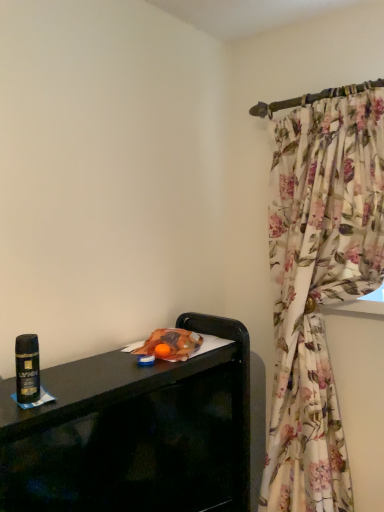
Find the location of a particular element. This screenshot has width=384, height=512. black glossy tv stand at lower left is located at coordinates (135, 433).

Image resolution: width=384 pixels, height=512 pixels. What do you see at coordinates (135, 433) in the screenshot?
I see `black glossy tv stand at lower left` at bounding box center [135, 433].

Image resolution: width=384 pixels, height=512 pixels. Identify the location of shiny black can at left. (27, 368).

The image size is (384, 512). Describe the element at coordinates (27, 368) in the screenshot. I see `shiny black can at left` at that location.

I want to click on black glossy tv stand at lower left, so click(x=135, y=433).

In the image, is black glossy tv stand at lower left on the left side or the right side of shiny black can at left?

black glossy tv stand at lower left is to the right of shiny black can at left.

Considering the relative positions of black glossy tv stand at lower left and shiny black can at left in the image provided, is black glossy tv stand at lower left in front of shiny black can at left?

No, it is behind shiny black can at left.

Does point (244, 474) lie behind point (21, 402)?

Yes.

From the image's perspective, is black glossy tv stand at lower left beneath shiny black can at left?

Indeed, from the image's perspective, black glossy tv stand at lower left is shown beneath shiny black can at left.

From a real-world perspective, is black glossy tv stand at lower left above or below shiny black can at left?

Clearly, from a real-world perspective, black glossy tv stand at lower left is below shiny black can at left.

Can you confirm if black glossy tv stand at lower left is wider than shiny black can at left?

Correct, the width of black glossy tv stand at lower left exceeds that of shiny black can at left.

Does black glossy tv stand at lower left have a greater height compared to shiny black can at left?

Indeed, black glossy tv stand at lower left has a greater height compared to shiny black can at left.

Does black glossy tv stand at lower left have a smaller size compared to shiny black can at left?

Actually, black glossy tv stand at lower left might be larger than shiny black can at left.

Is black glossy tv stand at lower left outside of shiny black can at left?

Yes.

Are black glossy tv stand at lower left and shiny black can at left beside each other?

No, black glossy tv stand at lower left is not touching shiny black can at left.

Is black glossy tv stand at lower left oriented away from shiny black can at left?

black glossy tv stand at lower left does not have its back to shiny black can at left.

Where is `furniture on the right of shiny black can at left`? furniture on the right of shiny black can at left is located at coordinates (135, 433).

Does shiny black can at left appear on the right side of black glossy tv stand at lower left?

No.

Between shiny black can at left and black glossy tv stand at lower left, which one is positioned in front?

shiny black can at left.

Which point is more forward, (27, 371) or (11, 430)?

The point (27, 371) is in front.

From the image's perspective, which object appears higher, shiny black can at left or black glossy tv stand at lower left?

shiny black can at left is shown above in the image.

Consider the image. From a real-world perspective, does shiny black can at left sit lower than black glossy tv stand at lower left?

No, from a real-world perspective, shiny black can at left is not below black glossy tv stand at lower left.

Is shiny black can at left wider than black glossy tv stand at lower left?

Incorrect, the width of shiny black can at left does not surpass that of black glossy tv stand at lower left.

Does shiny black can at left have a greater height compared to black glossy tv stand at lower left?

Incorrect, the height of shiny black can at left is not larger of that of black glossy tv stand at lower left.

Considering the sizes of shiny black can at left and black glossy tv stand at lower left in the image, is shiny black can at left bigger or smaller than black glossy tv stand at lower left?

shiny black can at left is smaller than black glossy tv stand at lower left.

Would you say shiny black can at left is inside or outside black glossy tv stand at lower left?

shiny black can at left is located beyond the bounds of black glossy tv stand at lower left.

Is shiny black can at left far away from black glossy tv stand at lower left?

No, there isn't a large distance between shiny black can at left and black glossy tv stand at lower left.

Is black glossy tv stand at lower left at the back of shiny black can at left?

No, shiny black can at left is not facing the opposite direction of black glossy tv stand at lower left.

How many degrees apart are the facing directions of shiny black can at left and black glossy tv stand at lower left?

The angle between the facing direction of shiny black can at left and the facing direction of black glossy tv stand at lower left is 23 degrees.

Where is `furniture lying below the shiny black can at left (from the image's perspective)`? Image resolution: width=384 pixels, height=512 pixels. furniture lying below the shiny black can at left (from the image's perspective) is located at coordinates (135, 433).

This screenshot has height=512, width=384. I want to click on furniture located behind the shiny black can at left, so click(135, 433).

The image size is (384, 512). I want to click on beverage that appears above the black glossy tv stand at lower left (from the image's perspective), so click(27, 368).